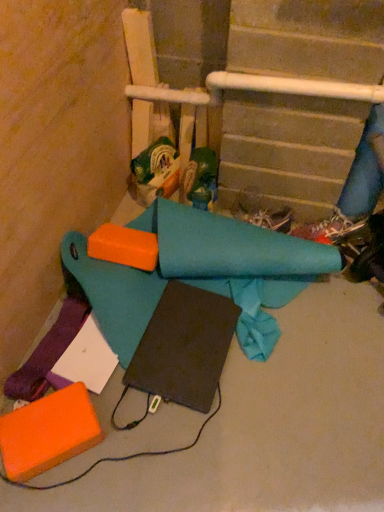
Question: In terms of width, does shiny black shoe at lower right look wider or thinner when compared to teal fabric at center, which is the second fabric from right to left?

Choices:
 (A) wide
 (B) thin

Answer: (B)

Question: From a real-world perspective, is shiny black shoe at lower right above or below teal fabric at center, which is the second fabric from right to left?

Choices:
 (A) above
 (B) below

Answer: (B)

Question: Estimate the real-world distances between objects in this image. Which object is closer to the shiny black shoe at lower right?

Choices:
 (A) purple fabric at lower left, which appears as the third fabric when viewed from the right
 (B) black matte notebook at center
 (C) blue fabric at right, which is the first fabric in right-to-left order
 (D) green cardboard box at center, the second toy in the right-to-left sequence
 (E) teal fabric at center, marked as the second fabric in a left-to-right arrangement

Answer: (C)

Question: Estimate the real-world distances between objects in this image. Which object is farther from the teal fabric at center, marked as the second fabric in a left-to-right arrangement?

Choices:
 (A) blue fabric at right, which is the first fabric in right-to-left order
 (B) purple fabric at lower left, which appears as the third fabric when viewed from the right
 (C) shiny black shoe at lower right
 (D) green cardboard box at center, the second toy in the right-to-left sequence
 (E) black matte notebook at center

Answer: (A)